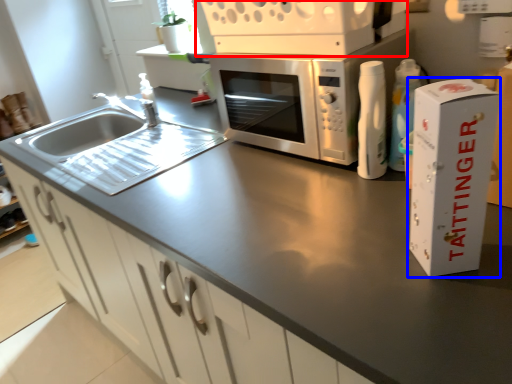
Question: Among these objects, which one is nearest to the camera, appliance (highlighted by a red box) or cardboard box (highlighted by a blue box)?

Choices:
 (A) appliance
 (B) cardboard box

Answer: (B)